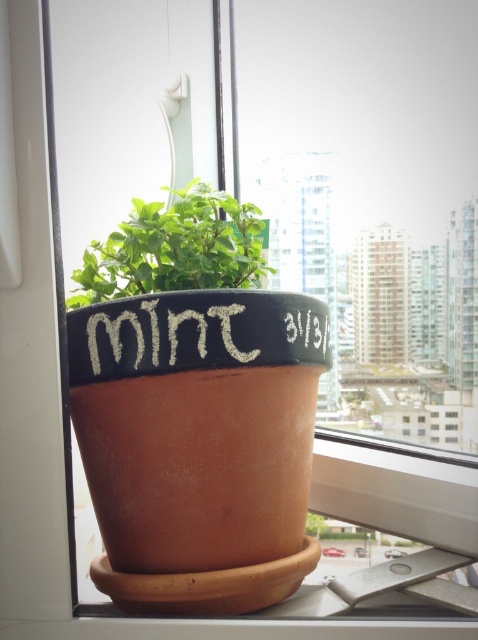
You are standing in front of the potted mint plant on the windowsill. You want to reach the point at coordinates point (231, 214). If your hand can extend 38 inches from your body, will you be able to reach that point?

The point (231, 214) is 38.76 inches from the camera. Since your hand can only extend 38 inches, you won not be able to reach it.

You are a photographer standing in front of a windowsill with a green matte mint at center. You want to take a closeup photo of the mint. If your camera requires you to be within 30 inches to focus properly, will you need to move closer or farther away?

The distance between the green matte mint at center and the camera is 36.00 inches. Since the camera needs to be within 30 inches to focus, you need to move closer to the green matte mint at center by 6 inches to achieve proper focus.

You are standing in front of the potted mint plant on the windowsill. You notice two points marked on the pot. Which point is closer to you, point (198,214) or point (122,336)?

Point (198,214) is further to the viewer than point (122,336), so point (122,336) is closer to you.